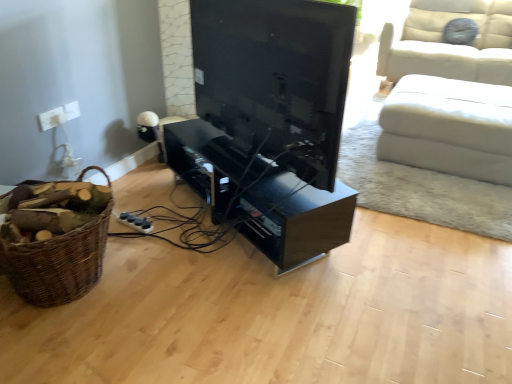
Question: From the image's perspective, is white leather ottoman at right above or below brown woven basket at left?

Choices:
 (A) above
 (B) below

Answer: (A)

Question: In terms of height, does white leather ottoman at right look taller or shorter compared to brown woven basket at left?

Choices:
 (A) tall
 (B) short

Answer: (B)

Question: Which is nearer to the white plastic socket at upper left?

Choices:
 (A) white leather ottoman at right
 (B) brown woven basket at left
 (C) black glossy entertainment center at center
 (D) matte black tv at center

Answer: (B)

Question: Considering the real-world distances, which object is farthest from the matte black tv at center?

Choices:
 (A) black glossy entertainment center at center
 (B) white leather ottoman at right
 (C) brown woven basket at left
 (D) white plastic socket at upper left

Answer: (B)